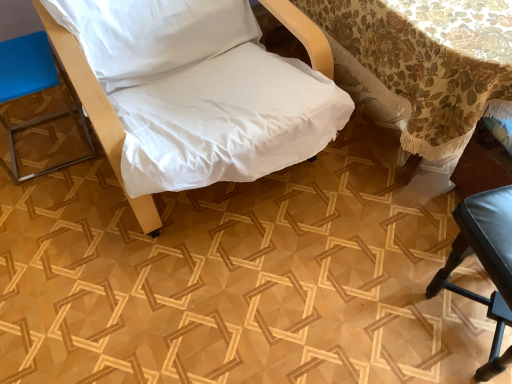
This screenshot has height=384, width=512. Find the location of `unoccupied space behind blue leather stool at left, the 1th furniture when ordered from left to right`. unoccupied space behind blue leather stool at left, the 1th furniture when ordered from left to right is located at coordinates (47, 105).